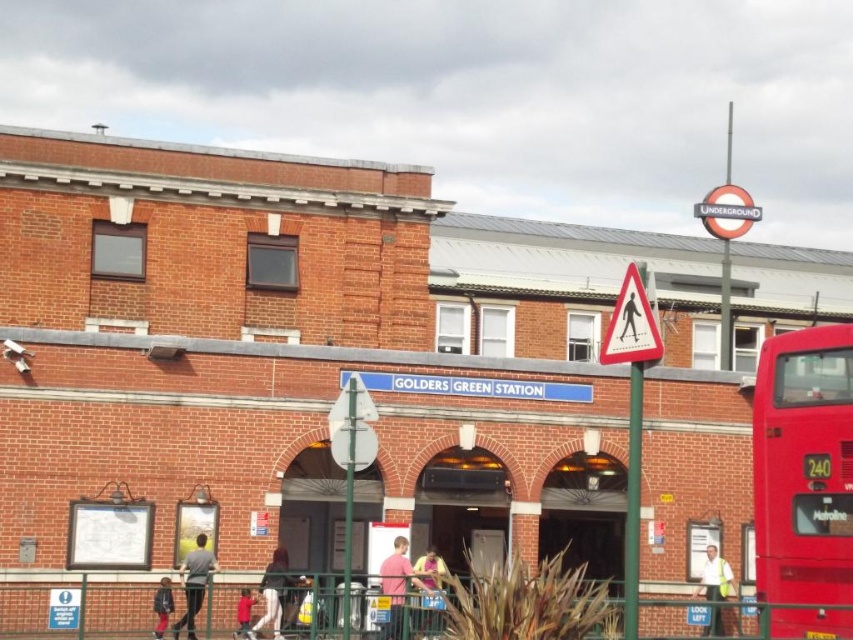
Does gray fabric jacket at lower left come behind pink fabric shirt at center?

Yes.

Between gray fabric jacket at lower left and pink fabric shirt at center, which one is positioned lower?

pink fabric shirt at center is below.

Identify the location of gray fabric jacket at lower left. Image resolution: width=853 pixels, height=640 pixels. (194, 582).

Who is more forward, [426,564] or [236,609]?

Point [426,564] is in front.

From the picture: Does pink fabric shirt at center have a greater height compared to red matte shirt at lower center?

Yes.

Between point (434, 572) and point (244, 589), which one is positioned behind?

The point (244, 589) is behind.

You are a GUI agent. You are given a task and a screenshot of the screen. Output one action in this format:
    pyautogui.click(x=<x>, y=<y>)
    Task: Click on the pink fabric shirt at center
    The width and height of the screenshot is (853, 640).
    Given the screenshot: What is the action you would take?
    pyautogui.click(x=430, y=570)

Who is higher up, pink matte shirt at center or gray fabric jacket at lower left?

Positioned higher is pink matte shirt at center.

Between pink matte shirt at center and gray fabric jacket at lower left, which one has less height?

pink matte shirt at center

The image size is (853, 640). What do you see at coordinates (397, 586) in the screenshot? I see `pink matte shirt at center` at bounding box center [397, 586].

This screenshot has height=640, width=853. Identify the location of pink matte shirt at center. (397, 586).